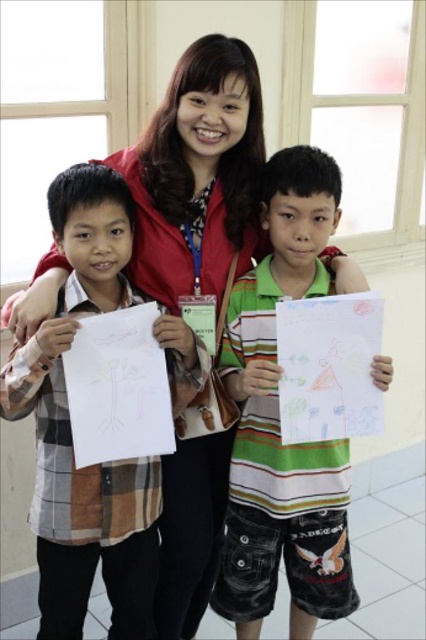
Identify the location of green striped shirt at center. (279, 422).

How distant is green striped shirt at center from white paper at left?

green striped shirt at center and white paper at left are 15.41 inches apart from each other.

Who is more distant from viewer, (232, 513) or (100, 435)?

The point (232, 513) is more distant.

Where is `green striped shirt at center`? green striped shirt at center is located at coordinates (279, 422).

Is point (226, 586) positioned in front of point (126, 243)?

No.

Who is lower down, green striped shirt at center or plaid shirt at left?

plaid shirt at left is lower down.

Identify the location of green striped shirt at center. (279, 422).

Between colored paper at center and white paper at left, which one is positioned lower?

Positioned lower is white paper at left.

Which of these two, colored paper at center or white paper at left, stands shorter?

With less height is colored paper at center.

The image size is (426, 640). I want to click on colored paper at center, so click(328, 365).